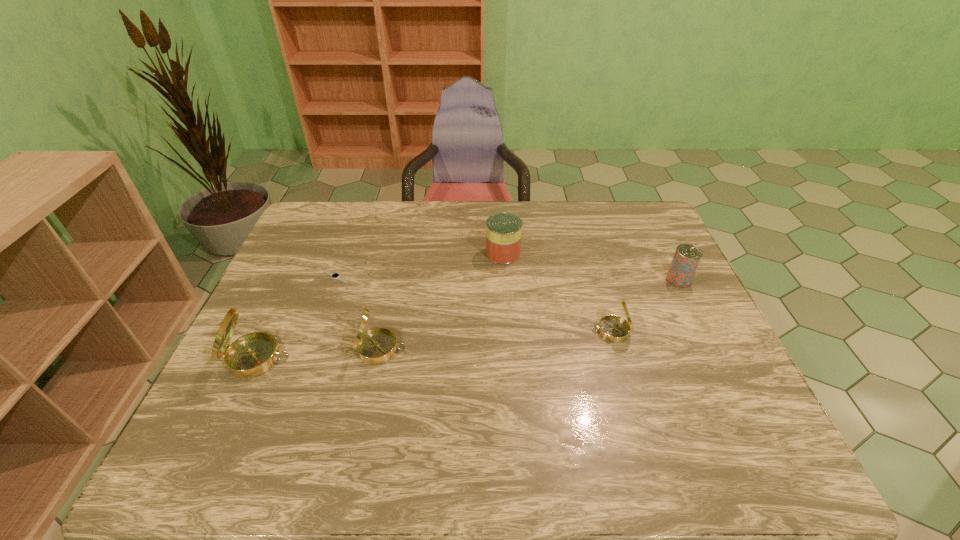
Please mark a free spot for a new compass to balance the arrangement. Please provide its 2D coordinates. Your answer should be formatted as a tuple, i.e. [(x, y)], where the tuple contains the x and y coordinates of a point satisfying the conditions above.

[(498, 340)]